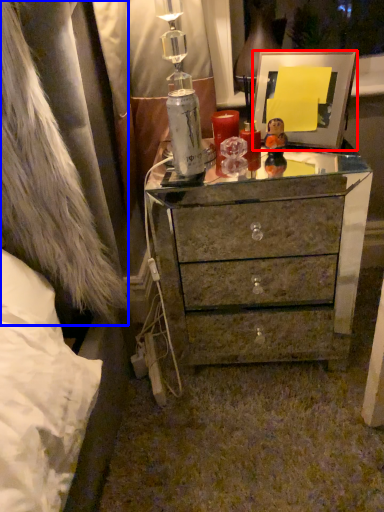
Question: Which of the following is the closest to the observer, picture frame (highlighted by a red box) or fur coat (highlighted by a blue box)?

Choices:
 (A) picture frame
 (B) fur coat

Answer: (B)